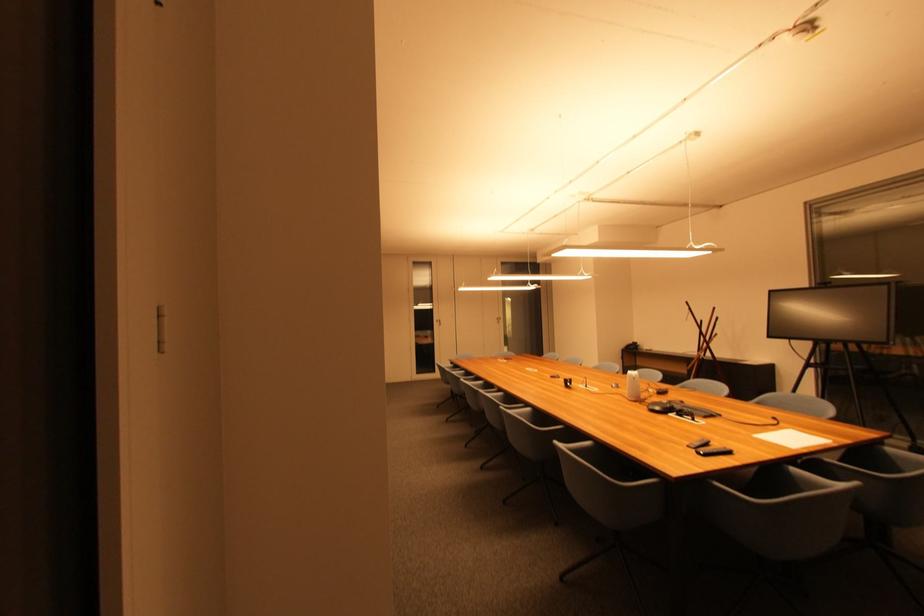
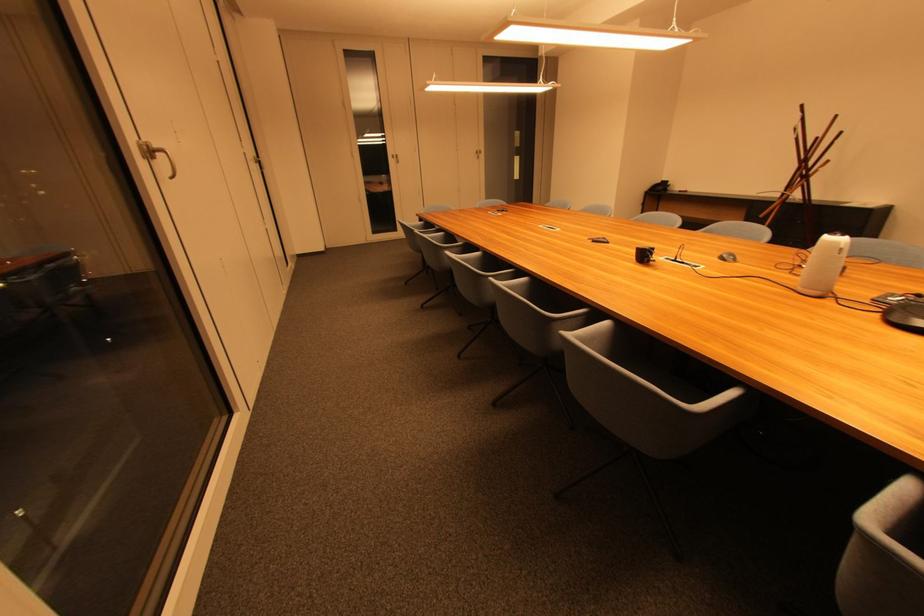
Question: Which direction would the cameraman need to move to produce the second image? Reply with the corresponding letter.

Choices:
 (A) Left
 (B) Right
 (C) Forward
 (D) Backward

Answer: (C)